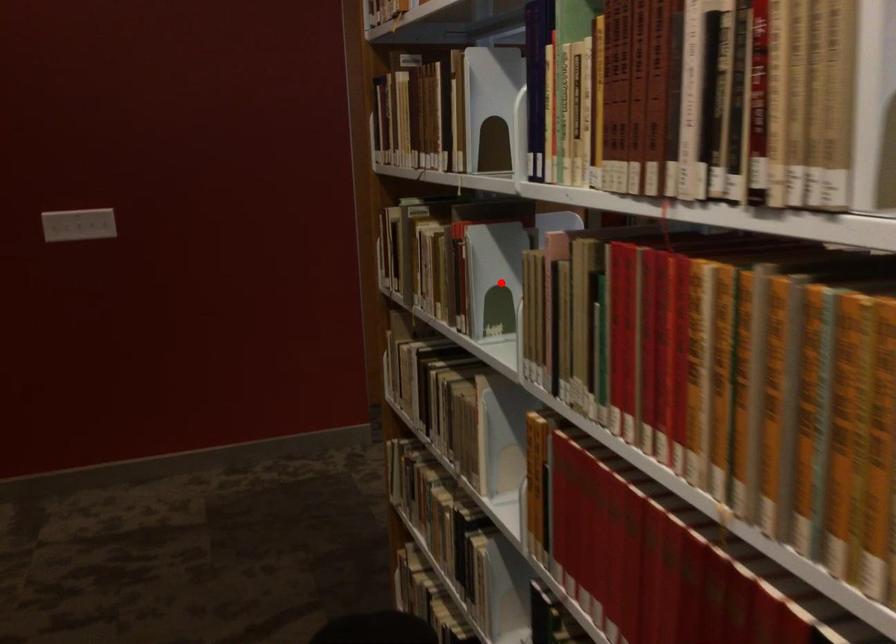
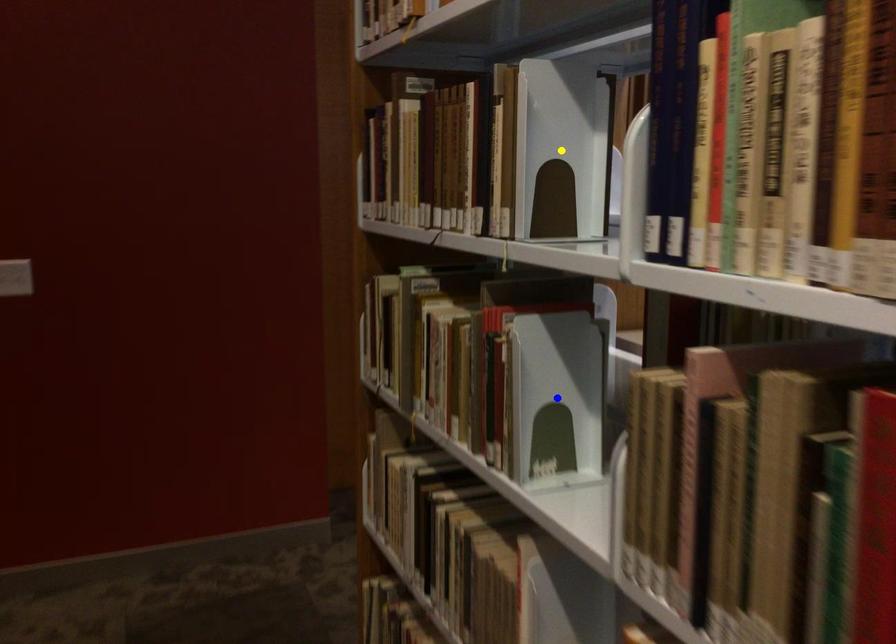
Question: I am providing you with two images of the same scene from different viewpoints. A red point is marked on the first image. You are given multiple points on the second image. In image 2, which mark is for the same physical point as the one in image 1?

Choices:
 (A) green point
 (B) yellow point
 (C) blue point

Answer: (C)